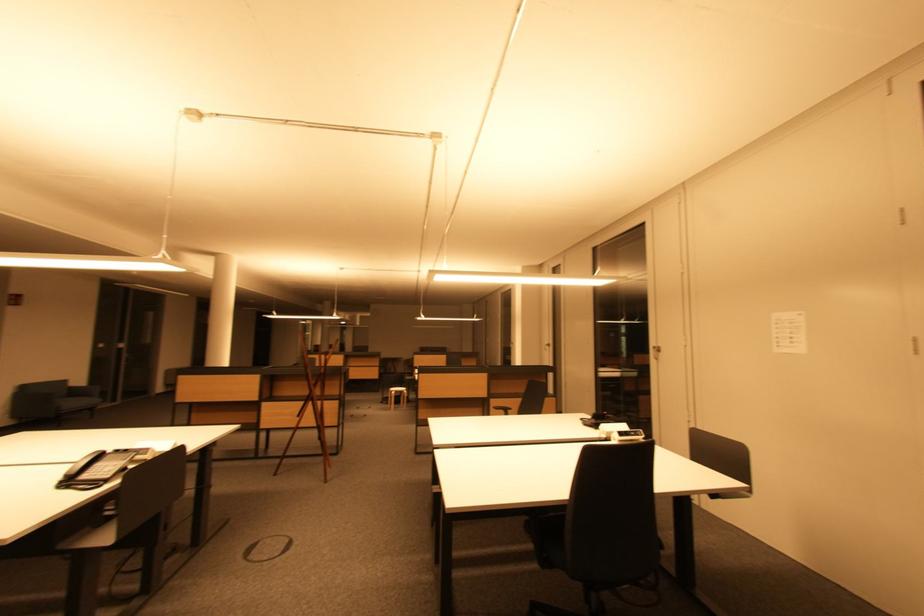
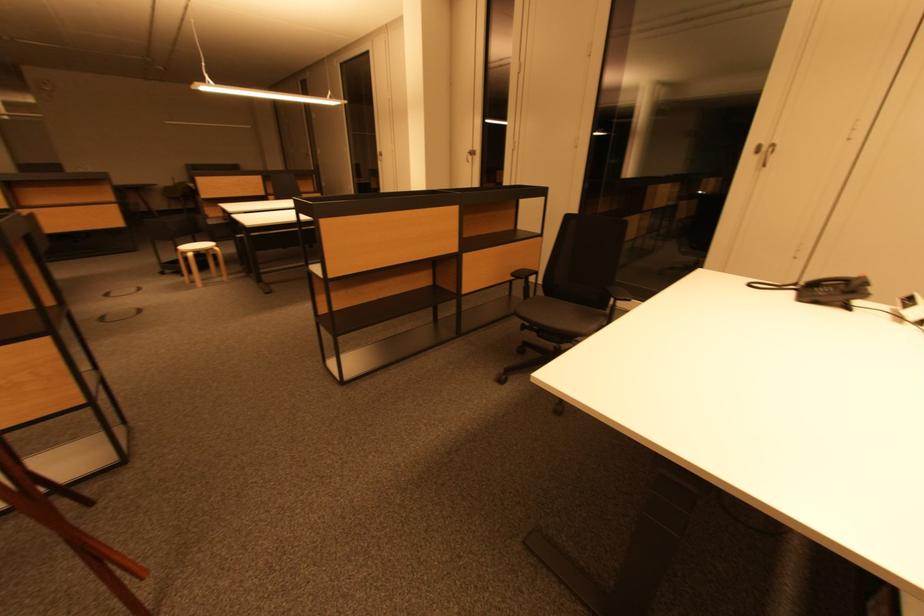
Where in the second image is the point corresponding to [552,346] from the first image?

(470, 152)